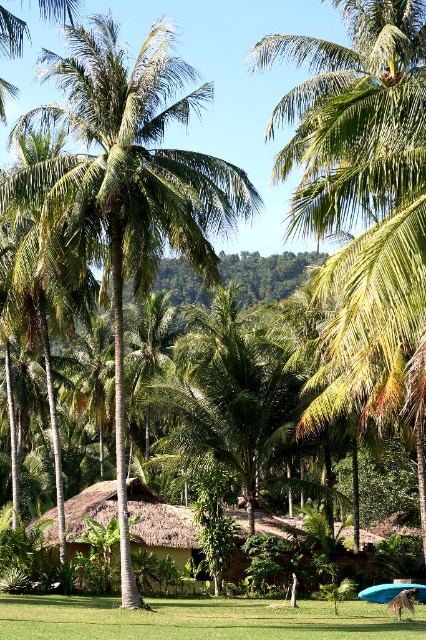
You are planning to set up a picnic area in this tropical setting. You have a large picnic blanket that needs space. Considering the green leafy palm tree at center and the green grass at lower center, which area would be more suitable for placing the blanket?

The green grass at lower center is more suitable for placing the picnic blanket because the green leafy palm tree at center is larger and might take up more space.

You are planning to place a 6 meter long decorative fence between the green leafy palm tree at center and the green grass at lower center. Is there enough space between them to fit the fence?

The distance between the green leafy palm tree at center and the green grass at lower center is 5.79 meters. Since the fence is 6 meters long, it is slightly too long to fit in the available space.

You are standing in the tropical setting and want to locate the green leafy palm tree at center. What are the coordinates where you should look?

The green leafy palm tree at center is located at coordinates point (x=129, y=182).